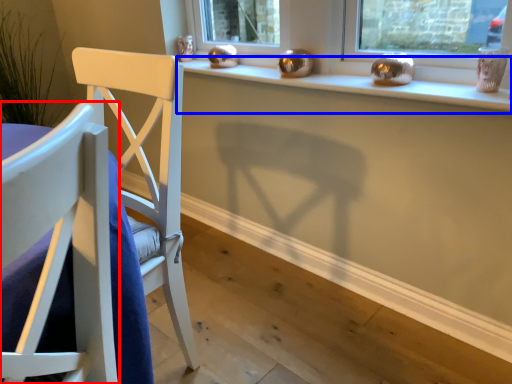
Question: Among these objects, which one is nearest to the camera, chair (highlighted by a red box) or window sill (highlighted by a blue box)?

Choices:
 (A) chair
 (B) window sill

Answer: (A)